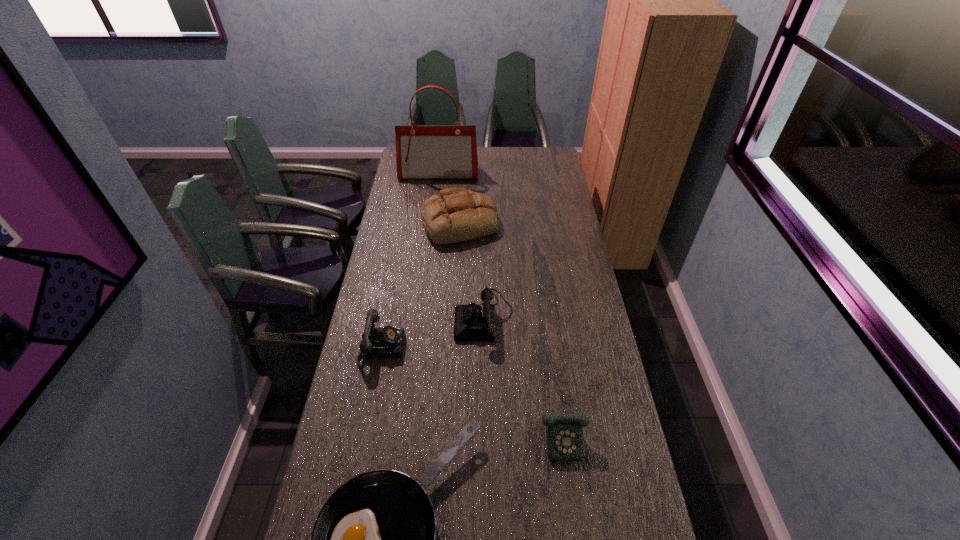
Image resolution: width=960 pixels, height=540 pixels. In order to click on object located at the far left corner in this screenshot , I will do `click(422, 151)`.

This screenshot has width=960, height=540. Identify the location of free region at the far edge. pyautogui.click(x=486, y=167).

Locate an element on the screen. vacant area at the left edge is located at coordinates (383, 372).

Identify the location of vacant space at the right edge. (606, 355).

Where is `free space between the second telephone from right to left and the farthest object`? free space between the second telephone from right to left and the farthest object is located at coordinates (461, 246).

Identify the location of vacant space in between the leftmost telephone and the rightmost telephone. The width and height of the screenshot is (960, 540). (478, 394).

You are a GUI agent. You are given a task and a screenshot of the screen. Output one action in this format:
    pyautogui.click(x=<x>, y=<y>)
    Task: Click on the free space between the bread and the second telephone from left to right
    This screenshot has width=960, height=540.
    Given the screenshot: What is the action you would take?
    pyautogui.click(x=471, y=270)

At what (x,y) coordinates should I click in order to perform the action: click on vacant area between the tallest object and the leftmost telephone. Please return your answer as a coordinate pair (x, y). Looking at the image, I should click on (410, 261).

Identify the location of free spot between the second telephone from right to left and the second farthest object. Image resolution: width=960 pixels, height=540 pixels. pos(471,270).

At what (x,y) coordinates should I click in order to perform the action: click on vacant area that lies between the farthest object and the fifth tallest object. Please return your answer as a coordinate pair (x, y). This screenshot has height=540, width=960. Looking at the image, I should click on (507, 306).